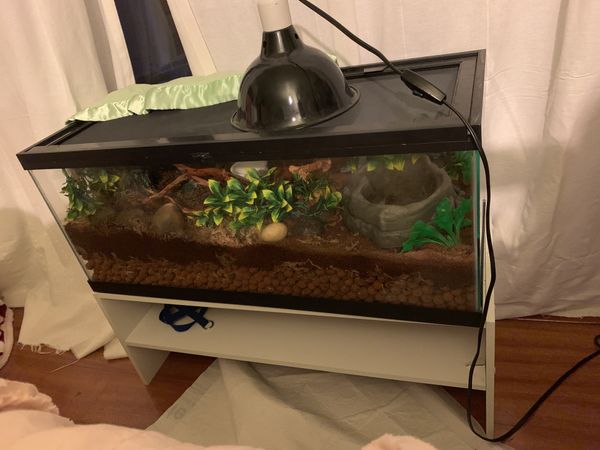
The width and height of the screenshot is (600, 450). I want to click on sheet, so click(x=337, y=417).